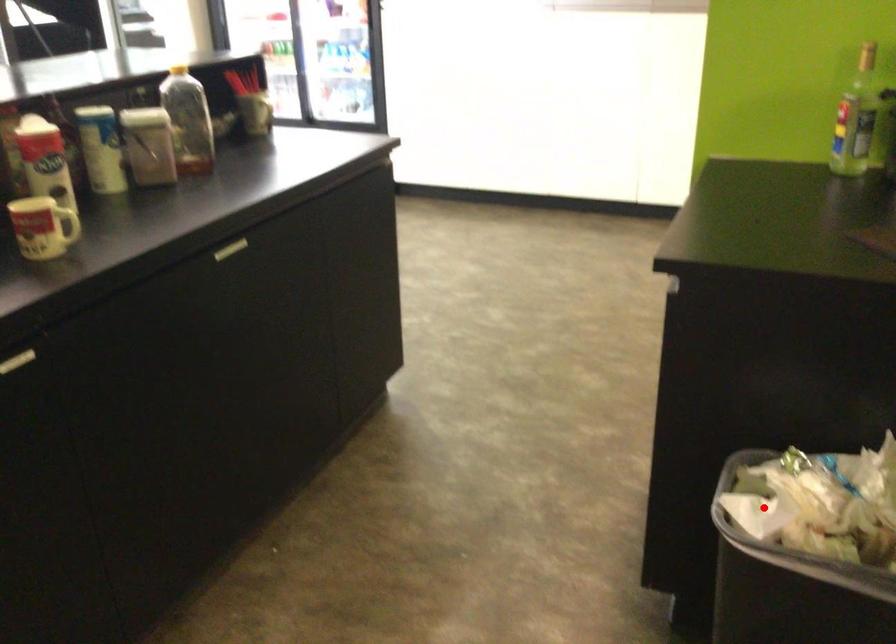
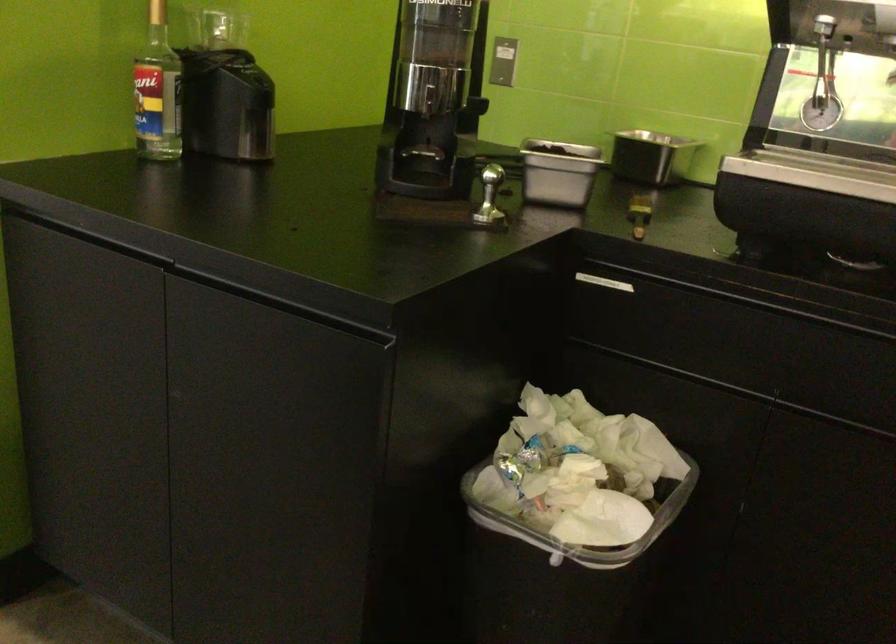
Question: I am providing you with two images of the same scene from different viewpoints. Given a red point in image1, look at the same physical point in image2. Is it:

Choices:
 (A) Closer to the viewpoint
 (B) Farther from the viewpoint

Answer: (A)